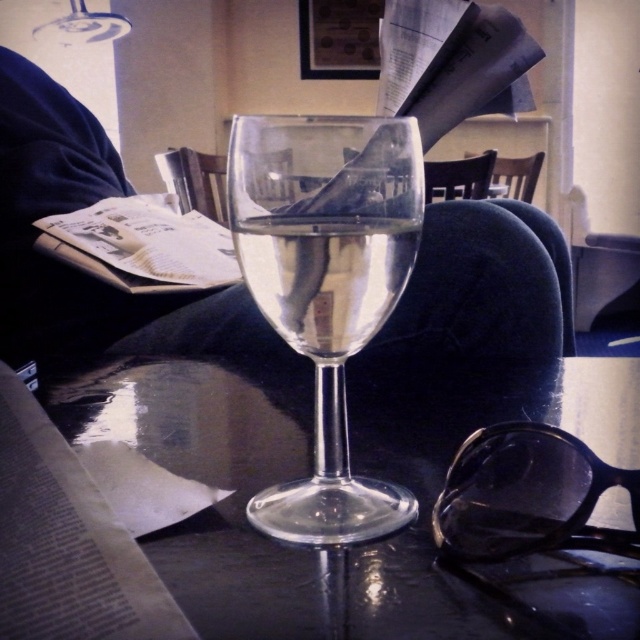
Question: Which is nearer to the transparent plastic goggles at lower right?

Choices:
 (A) clear glass wine at center
 (B) transparent glass table at center
 (C) transparent glass wine glass at center

Answer: (C)

Question: In this image, where is transparent glass table at center located relative to transparent glass wine glass at center?

Choices:
 (A) below
 (B) above

Answer: (A)

Question: Is transparent plastic goggles at lower right positioned before clear glass wine at center?

Choices:
 (A) no
 (B) yes

Answer: (B)

Question: Which object appears farthest from the camera in this image?

Choices:
 (A) clear glass wine at center
 (B) transparent glass table at center
 (C) transparent glass wine glass at center
 (D) transparent plastic goggles at lower right

Answer: (A)

Question: Which point is closer to the camera?

Choices:
 (A) transparent plastic goggles at lower right
 (B) transparent glass table at center

Answer: (B)

Question: Is transparent glass wine glass at center to the right of clear glass wine at center from the viewer's perspective?

Choices:
 (A) no
 (B) yes

Answer: (B)